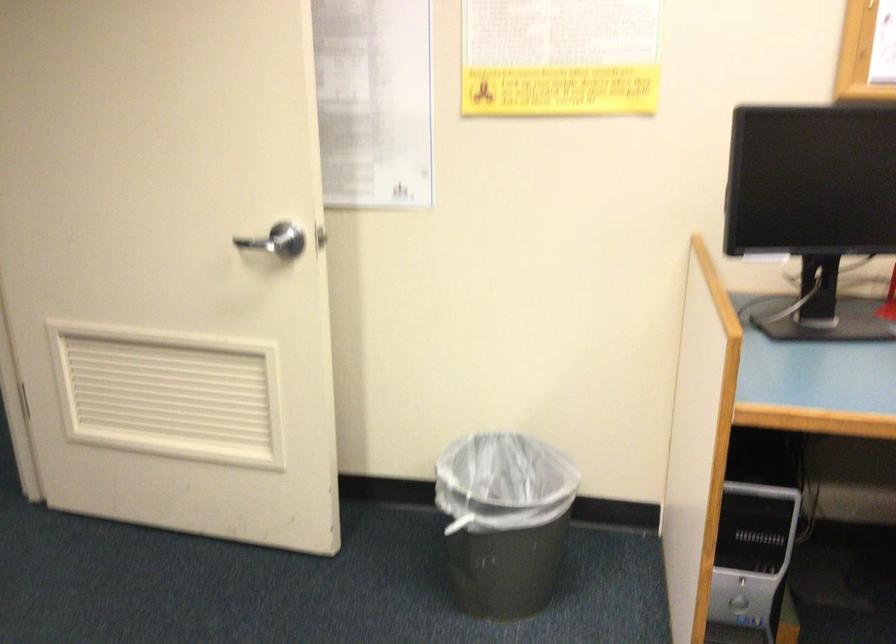
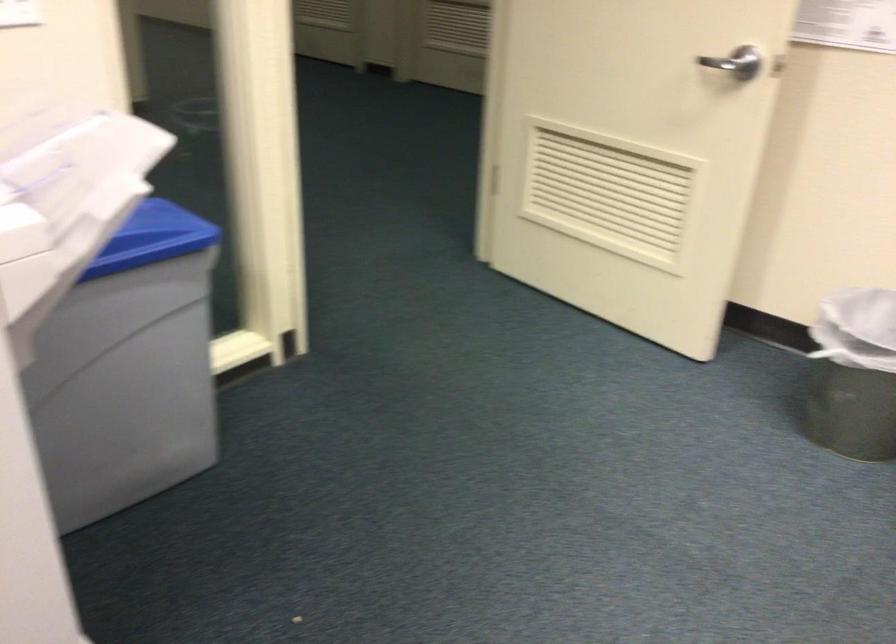
Question: The camera is either moving clockwise (left) or counter-clockwise (right) around the object. The first image is from the beginning of the video and the second image is from the end. Is the camera moving left or right when shooting the video?

Choices:
 (A) Left
 (B) Right

Answer: (B)